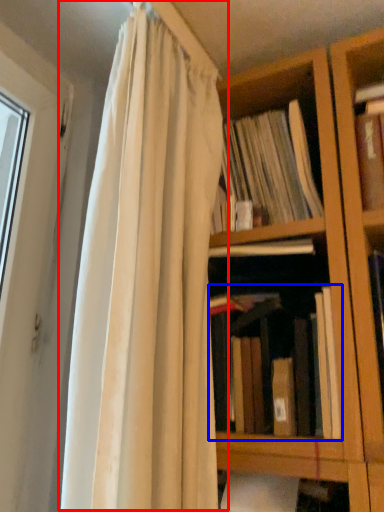
Question: Among these objects, which one is nearest to the camera, curtain (highlighted by a red box) or book (highlighted by a blue box)?

Choices:
 (A) curtain
 (B) book

Answer: (A)